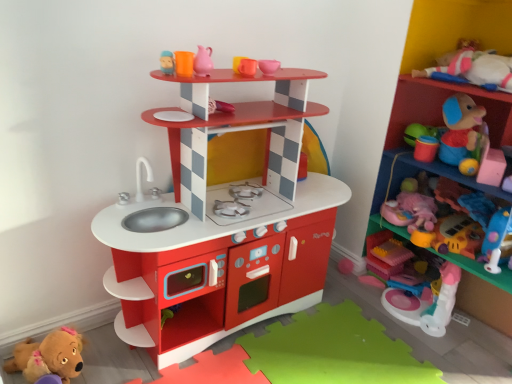
Where is `free spot in front of translucent pink plastic blocks at lower right, which is the third toy in top-to-bottom order`? free spot in front of translucent pink plastic blocks at lower right, which is the third toy in top-to-bottom order is located at coordinates (396, 291).